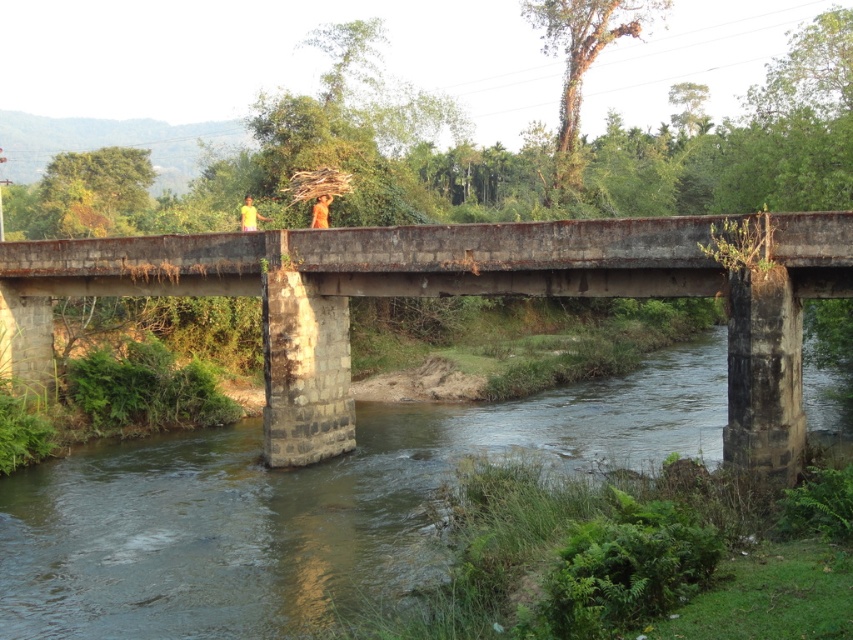
Is yellow fabric monk at center thinner than orange fabric monk at center?

Incorrect, yellow fabric monk at center's width is not less than orange fabric monk at center's.

Does point (254, 228) lie behind point (322, 220)?

That is False.

The height and width of the screenshot is (640, 853). In order to click on yellow fabric monk at center in this screenshot , I will do `click(248, 216)`.

At what (x,y) coordinates should I click in order to perform the action: click on yellow fabric monk at center. Please return your answer as a coordinate pair (x, y). Looking at the image, I should click on (248, 216).

Which is above, rusty concrete bridge at center or orange fabric monk at center?

orange fabric monk at center is higher up.

Can you confirm if rusty concrete bridge at center is positioned to the right of orange fabric monk at center?

Yes, rusty concrete bridge at center is to the right of orange fabric monk at center.

Identify the location of rusty concrete bridge at center. (450, 294).

Locate an element on the screen. The width and height of the screenshot is (853, 640). rusty concrete bridge at center is located at coordinates (450, 294).

Is brown concrete river at center wider than yellow fabric monk at center?

Yes.

Is point (143, 484) farther from camera compared to point (265, 220)?

That is False.

Is point (73, 628) farther from camera compared to point (263, 220)?

No, (73, 628) is in front of (263, 220).

Identify the location of brown concrete river at center. This screenshot has height=640, width=853. (305, 506).